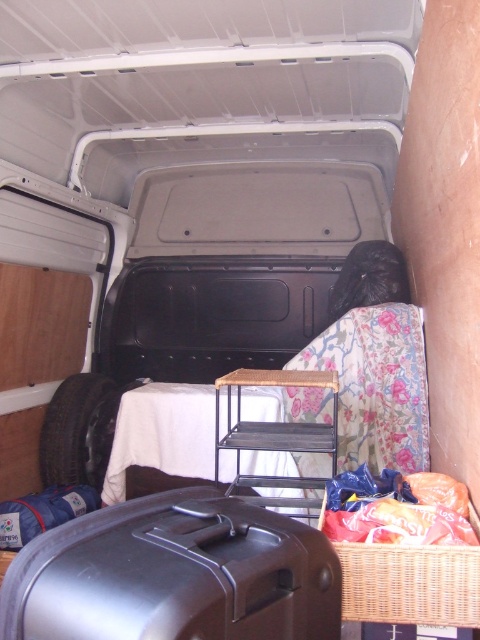
Question: Which object is farther from the camera taking this photo?

Choices:
 (A) woven brown basket at lower right
 (B) plastic bagged food at lower right
 (C) black rubber tire at left

Answer: (C)

Question: Can you confirm if woven brown basket at lower right is positioned below black rubber tire at left?

Choices:
 (A) no
 (B) yes

Answer: (A)

Question: Among these points, which one is nearest to the camera?

Choices:
 (A) (423, 540)
 (B) (56, 444)
 (C) (140, 272)
 (D) (435, 612)

Answer: (D)

Question: Can you confirm if floral fabric chair at center is positioned to the right of shiny black suitcase at lower center?

Choices:
 (A) yes
 (B) no

Answer: (B)

Question: Which point is closer to the camera?

Choices:
 (A) (298, 179)
 (B) (354, 552)
 (C) (94, 410)
 (D) (325, 516)

Answer: (B)

Question: Is floral fabric chair at center below black rubber tire at left?

Choices:
 (A) yes
 (B) no

Answer: (B)